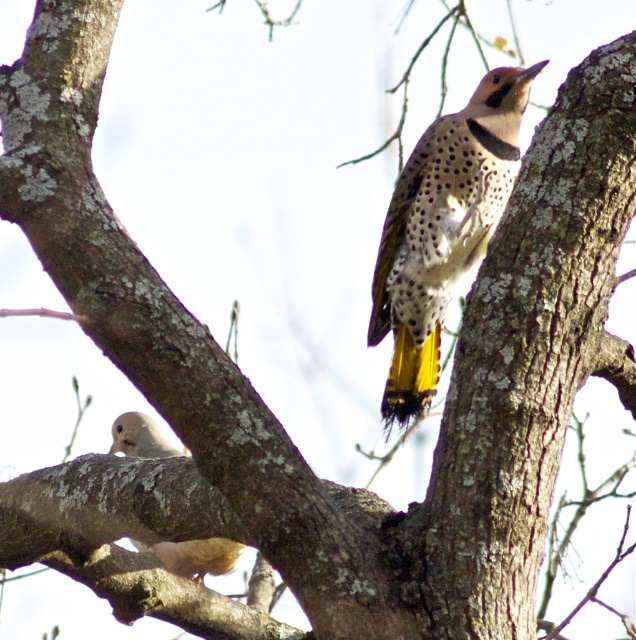
You are an ornithologist observing a birdwatching scene. You notice the spotted feathered woodpecker at center and the light brown textured owl at lower left. Which bird has a greater width in the image?

The spotted feathered woodpecker at center is wider than the light brown textured owl at lower left according to the description.

You are a birdwatcher trying to identify birds in the image. You see the spotted feathered woodpecker at center and the light brown textured owl at lower left. Which bird is closer to you?

The spotted feathered woodpecker at center is closer to you because it is in front of the light brown textured owl at lower left.